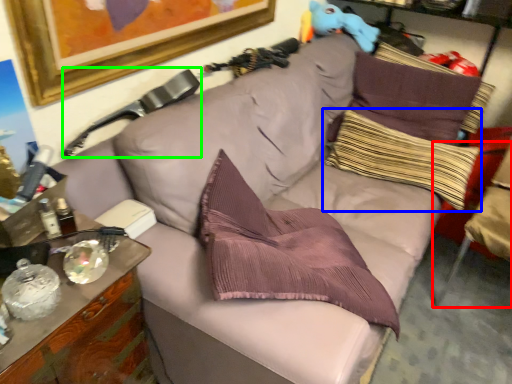
Question: Which object is the closest to the swivel chair (highlighted by a red box)? Choose among these: pillow (highlighted by a blue box) or swivel chair (highlighted by a green box).

Choices:
 (A) pillow
 (B) swivel chair

Answer: (A)